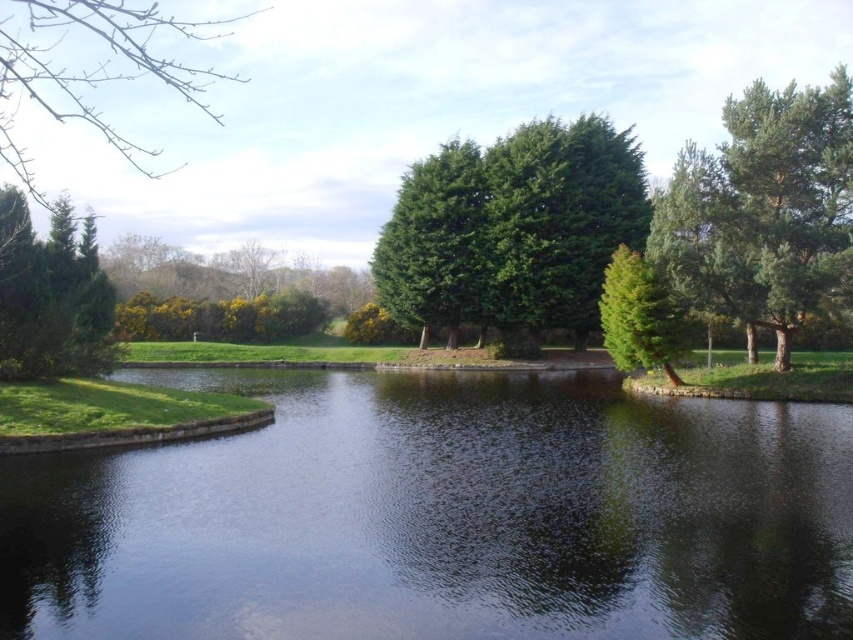
Question: Based on their relative distances, which object is nearer to the bare branches at upper left?

Choices:
 (A) green textured tree at center
 (B) green needle-like at right

Answer: (A)

Question: Is green leafy tree at center to the left of green matte tree at upper left from the viewer's perspective?

Choices:
 (A) no
 (B) yes

Answer: (A)

Question: Estimate the real-world distances between objects in this image. Which object is farther from the green matte tree at upper left?

Choices:
 (A) green leafy tree at center
 (B) green needle-like at right
 (C) green matte tree at center
 (D) transparent water at center

Answer: (A)

Question: Which of the following is the farthest from the observer?

Choices:
 (A) green textured tree at center
 (B) bare branches at upper left
 (C) green matte tree at upper left
 (D) transparent water at center

Answer: (B)

Question: Can you confirm if transparent water at center is wider than green textured tree at center?

Choices:
 (A) yes
 (B) no

Answer: (A)

Question: Observing the image, what is the correct spatial positioning of green textured tree at center in reference to green matte tree at upper left?

Choices:
 (A) above
 (B) below

Answer: (A)